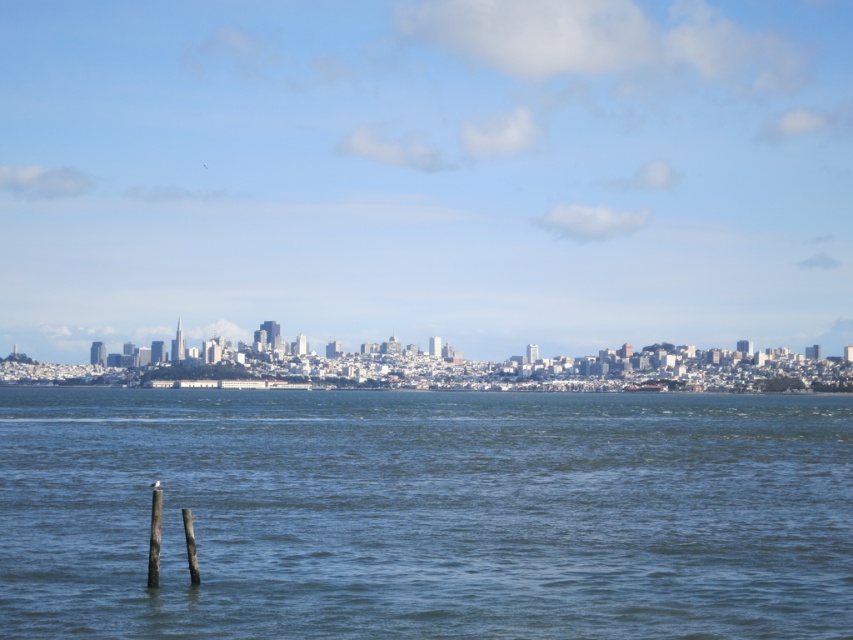
Is wooden post at lower left bigger than metallic gray ship at center?

Correct, wooden post at lower left is larger in size than metallic gray ship at center.

Is point (158, 570) less distant than point (645, 388)?

Yes, it is.

Is point (157, 548) in front of point (635, 388)?

Yes, it is in front of point (635, 388).

What are the coordinates of `wooden post at lower left` in the screenshot? It's located at [154, 538].

Is blue water at center positioned before metallic gray ship at center?

Yes, it is in front of metallic gray ship at center.

Is blue water at center to the left of metallic gray ship at center from the viewer's perspective?

Indeed, blue water at center is positioned on the left side of metallic gray ship at center.

The image size is (853, 640). What do you see at coordinates (426, 513) in the screenshot?
I see `blue water at center` at bounding box center [426, 513].

Identify the location of blue water at center. The width and height of the screenshot is (853, 640). (426, 513).

Can you confirm if blue water at center is positioned to the left of wooden post at lower left?

In fact, blue water at center is to the right of wooden post at lower left.

Which is below, blue water at center or wooden post at lower left?

blue water at center is below.

Measure the distance between point (746, 577) and camera.

Point (746, 577) and camera are 38.63 meters apart.

The width and height of the screenshot is (853, 640). Find the location of `blue water at center`. blue water at center is located at coordinates (426, 513).